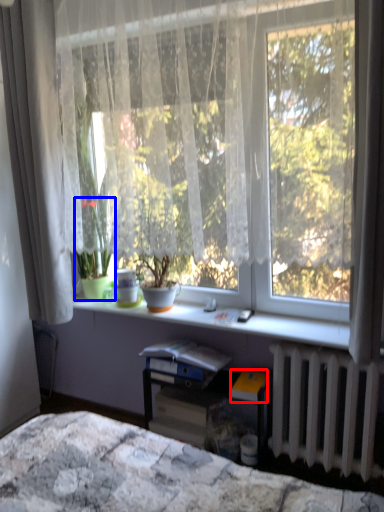
Question: Which object appears farthest to the camera in this image, paperback book (highlighted by a red box) or houseplant (highlighted by a blue box)?

Choices:
 (A) paperback book
 (B) houseplant

Answer: (B)